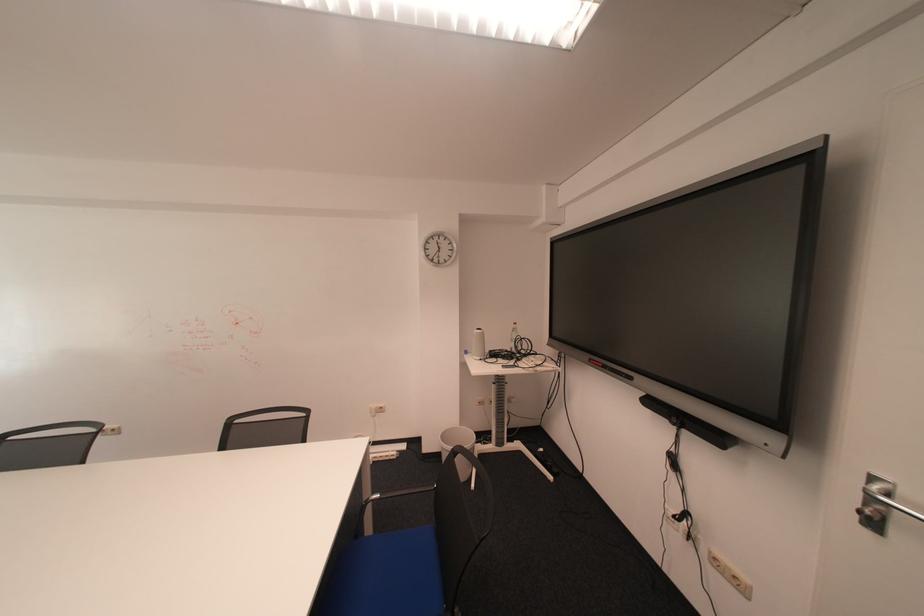
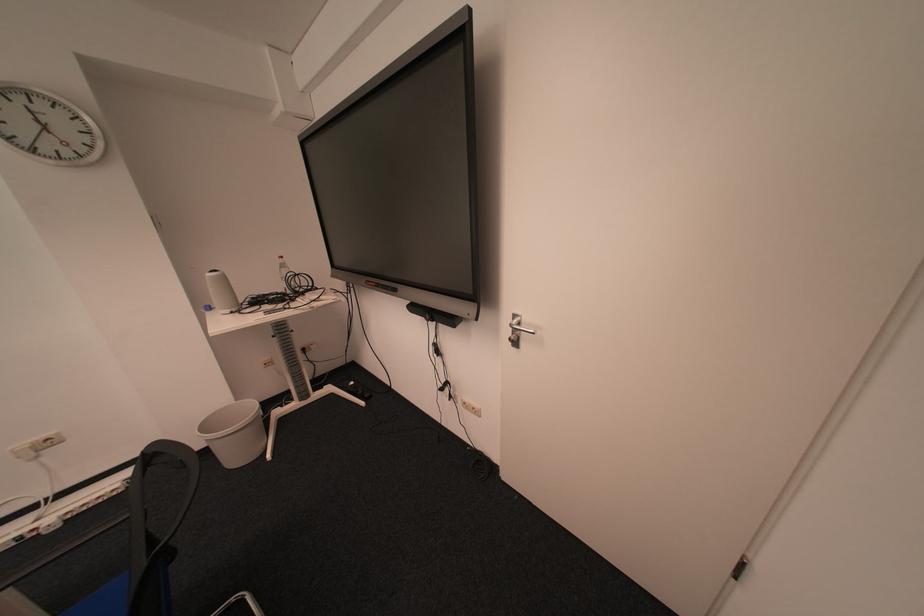
Locate, in the second image, the point that corresponds to (x=884, y=501) in the first image.

(525, 330)